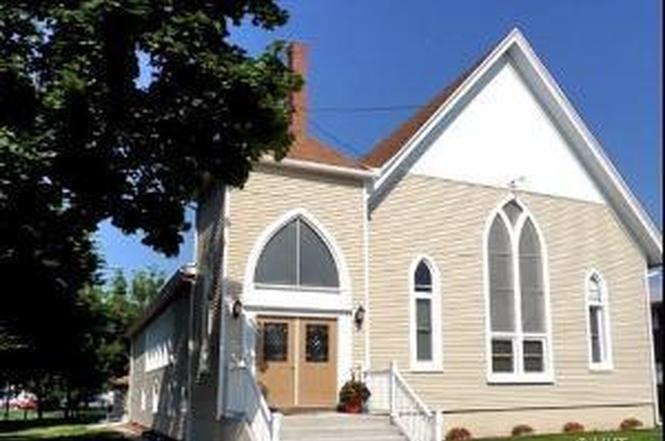
The width and height of the screenshot is (665, 441). Identify the location of stairs. (342, 421).